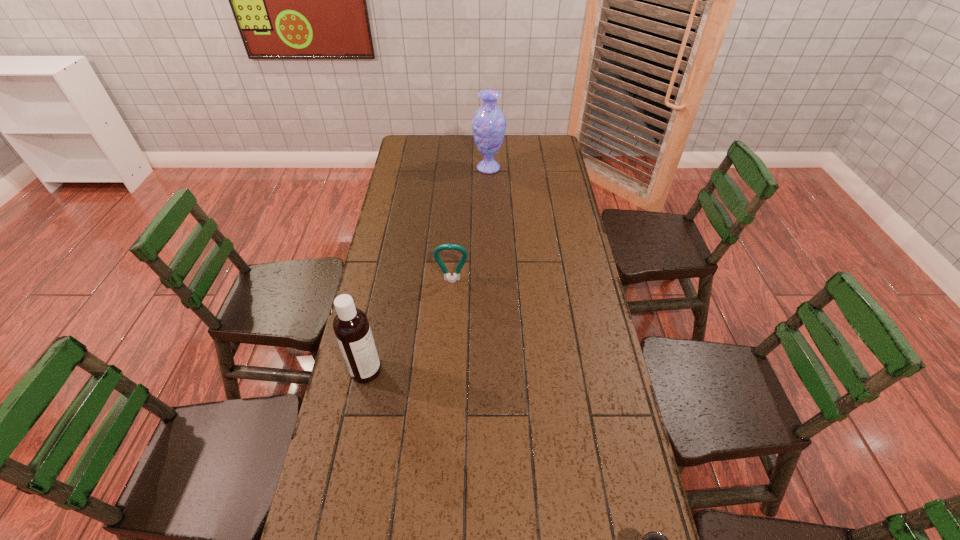
Identify which object is the second closest to the second shortest object. Please provide its 2D coordinates. Your answer should be formatted as a tuple, i.e. [(x, y)], where the tuple contains the x and y coordinates of a point satisfying the conditions above.

[(489, 123)]

The width and height of the screenshot is (960, 540). I want to click on the third closest object relative to the leftmost object, so click(x=489, y=123).

Identify the location of vacant region that satisfies the following two spatial constraints: 1. at the jaws of the third object from right to left; 2. on the label side of the dishwasher detergent. This screenshot has width=960, height=540. (446, 371).